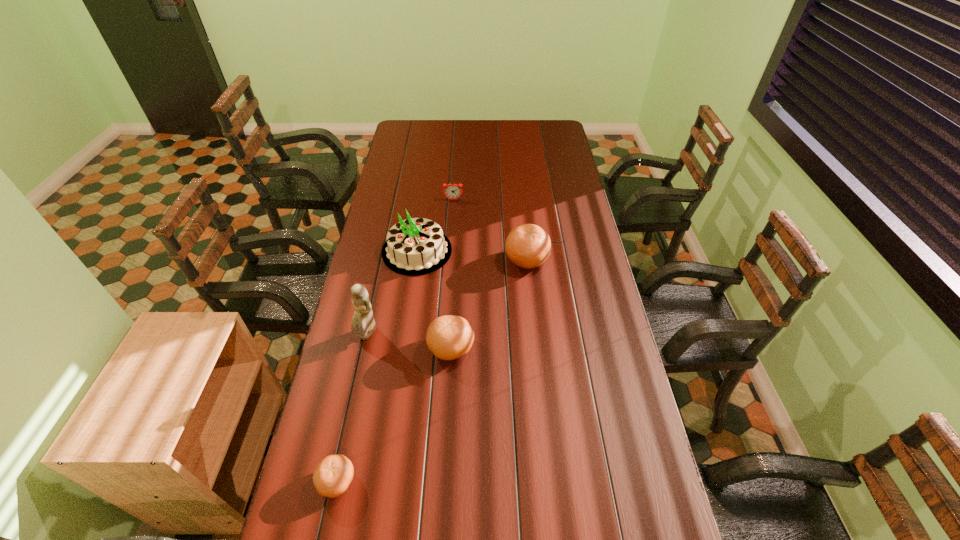
You are a GUI agent. You are given a task and a screenshot of the screen. Output one action in this format:
    pyautogui.click(x=<x>, y=<y>)
    Task: Click on the leftmost clementine
    
    Given the screenshot: What is the action you would take?
    click(x=333, y=475)

Identify the location of the nearest clementine. (333, 475).

This screenshot has height=540, width=960. I want to click on the fourth tallest object, so click(448, 337).

The height and width of the screenshot is (540, 960). I want to click on the second clementine from left to right, so click(448, 337).

Where is `the farthest clementine`? This screenshot has width=960, height=540. the farthest clementine is located at coordinates (527, 246).

The height and width of the screenshot is (540, 960). In order to click on the rightmost clementine in this screenshot , I will do `click(527, 246)`.

You are a GUI agent. You are given a task and a screenshot of the screen. Output one action in this format:
    pyautogui.click(x=<x>, y=<y>)
    Task: Click on the farthest object
    This screenshot has height=540, width=960.
    Given the screenshot: What is the action you would take?
    pyautogui.click(x=452, y=191)

Where is `the tallest object`? the tallest object is located at coordinates (363, 324).

Image resolution: width=960 pixels, height=540 pixels. What are the coordinates of `birthday cake` in the screenshot? It's located at (415, 246).

The height and width of the screenshot is (540, 960). Find the location of `free space located 0.090m on the back of the shortest clementine`. free space located 0.090m on the back of the shortest clementine is located at coordinates (348, 429).